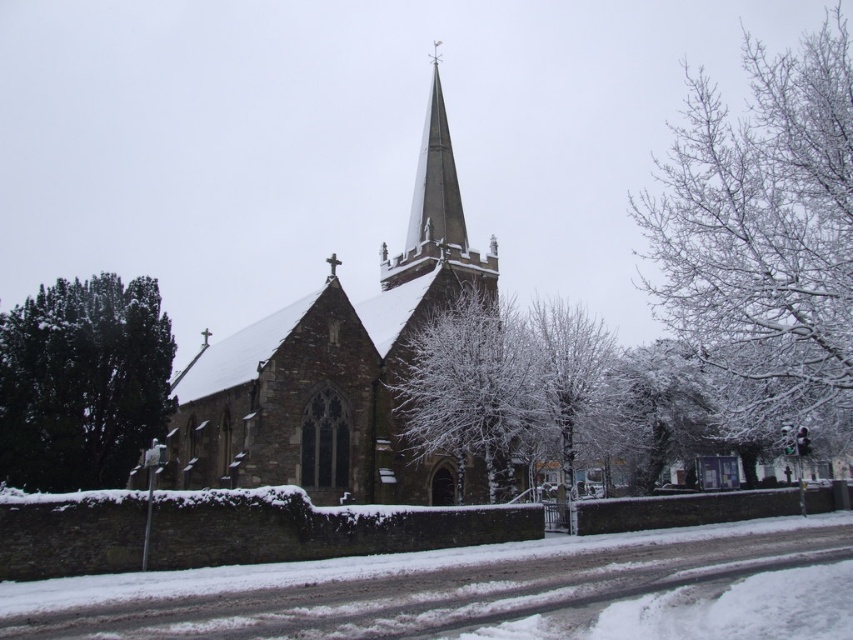
You are standing at point A, which is located at coordinates (338, 369). What is the nearest object to you in the scene?

The nearest object to you at point A is the stone church at center, which is located exactly at your current coordinates.